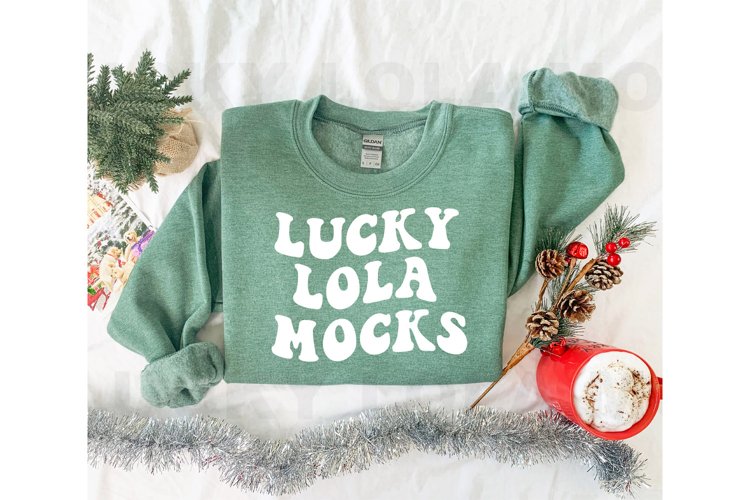
This screenshot has height=500, width=750. I want to click on red cup, so click(553, 370).